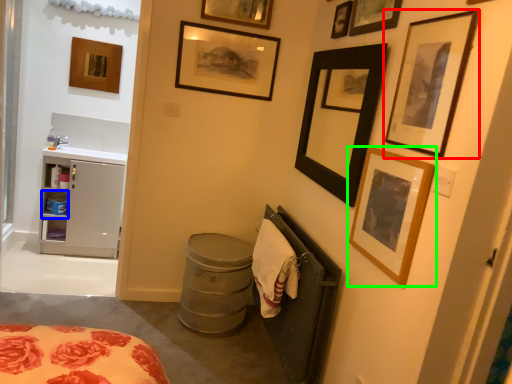
Question: Which is farther away from picture frame (highlighted by a red box)? cabinet (highlighted by a blue box) or picture frame (highlighted by a green box)?

Choices:
 (A) cabinet
 (B) picture frame

Answer: (A)